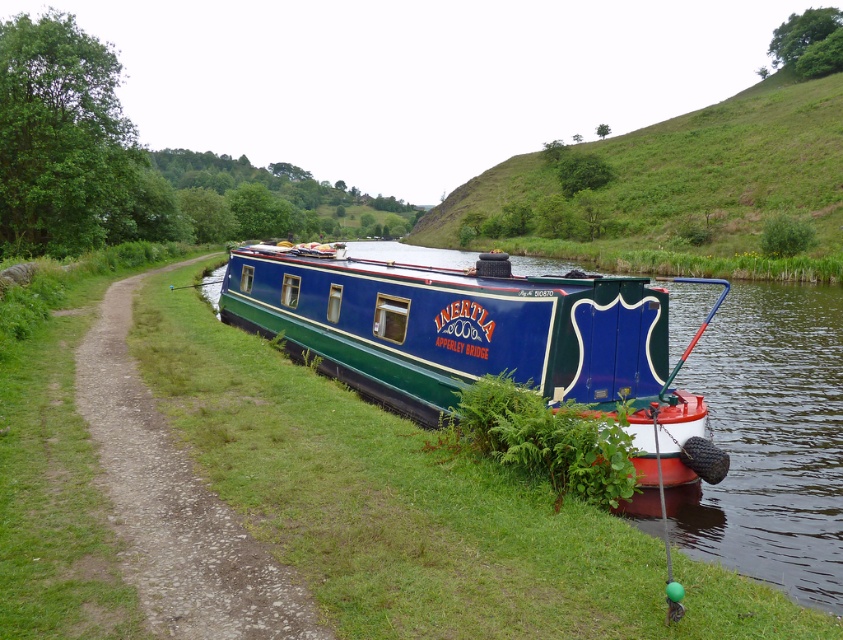
Question: Is blue glossy barge at center to the right of blue/green painted narrowboat at right from the viewer's perspective?

Choices:
 (A) no
 (B) yes

Answer: (B)

Question: Does blue glossy barge at center appear under blue/green painted narrowboat at right?

Choices:
 (A) no
 (B) yes

Answer: (A)

Question: Among these points, which one is nearest to the camera?

Choices:
 (A) (519, 189)
 (B) (400, 506)
 (C) (503, 342)

Answer: (B)

Question: Which point is farther to the camera?

Choices:
 (A) green grass at lower center
 (B) blue glossy barge at center
 (C) blue/green painted narrowboat at right
 (D) green grassy hillside at upper center

Answer: (D)

Question: Does blue glossy barge at center have a smaller size compared to green grassy hillside at upper center?

Choices:
 (A) yes
 (B) no

Answer: (A)

Question: Which point appears closest to the camera in this image?

Choices:
 (A) [x=557, y=180]
 (B) [x=51, y=390]
 (C) [x=81, y=401]

Answer: (C)